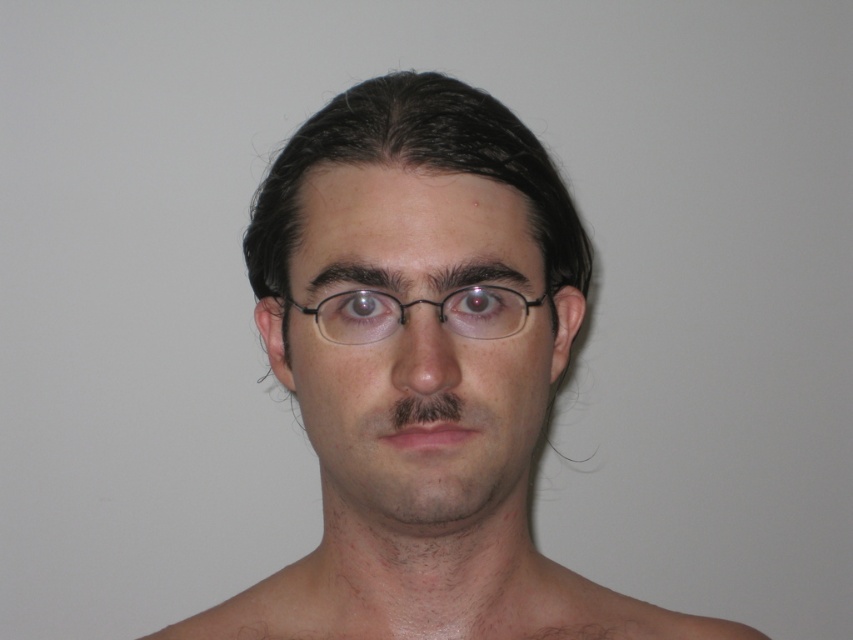
Question: Does smooth skin man at center have a smaller size compared to smooth skin face at center?

Choices:
 (A) no
 (B) yes

Answer: (A)

Question: Can you confirm if smooth skin face at center is positioned below black plastic glasses at center?

Choices:
 (A) yes
 (B) no

Answer: (A)

Question: Estimate the real-world distances between objects in this image. Which object is closer to the smooth skin face at center?

Choices:
 (A) black plastic glasses at center
 (B) smooth skin man at center

Answer: (B)

Question: From the image, what is the correct spatial relationship of smooth skin face at center in relation to black plastic glasses at center?

Choices:
 (A) below
 (B) above

Answer: (A)

Question: Which point is farther from the camera taking this photo?

Choices:
 (A) 439,481
 (B) 300,348

Answer: (B)

Question: Which object is positioned closest to the smooth skin face at center?

Choices:
 (A) black plastic glasses at center
 (B) smooth skin man at center

Answer: (B)